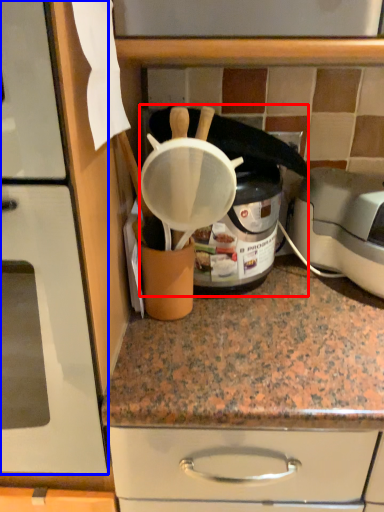
Question: Which object appears farthest to the camera in this image, appliance (highlighted by a red box) or home appliance (highlighted by a blue box)?

Choices:
 (A) appliance
 (B) home appliance

Answer: (A)